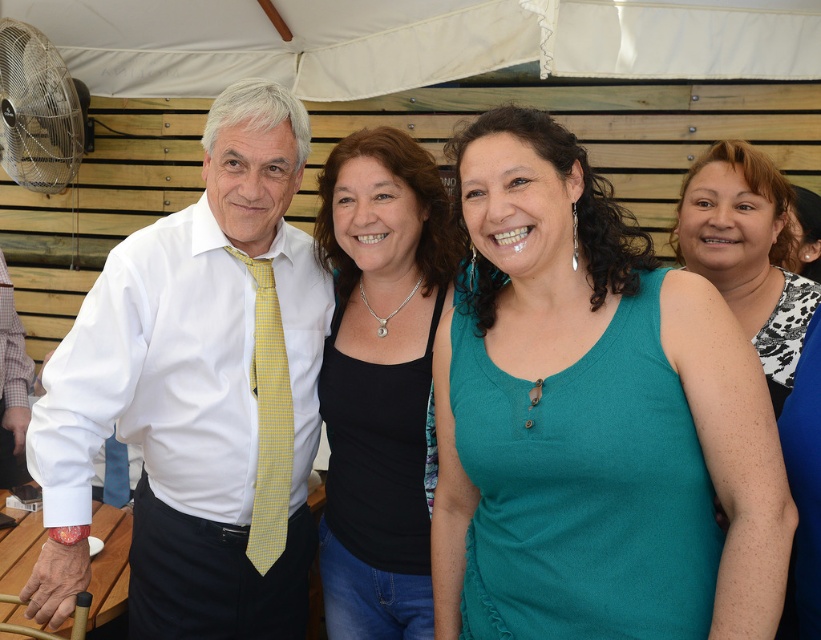
You are at the center of the image and want to place a teal fabric tank top at center. Where should you place it?

The teal fabric tank top at center should be placed at the coordinates point (592,419) as specified in the description.

You are standing in front of the group under the white canopy tent. Which person is closer to you, the white shirt at left or the black matte tank top at center?

The white shirt at left is closer to the viewer than the black matte tank top at center.

You are a photographer trying to capture a candid shot of the white shirt at left and the black matte tank top at center. Based on their positions, which one is higher in the frame?

The white shirt at left is above the black matte tank top at center, so it is higher in the frame.